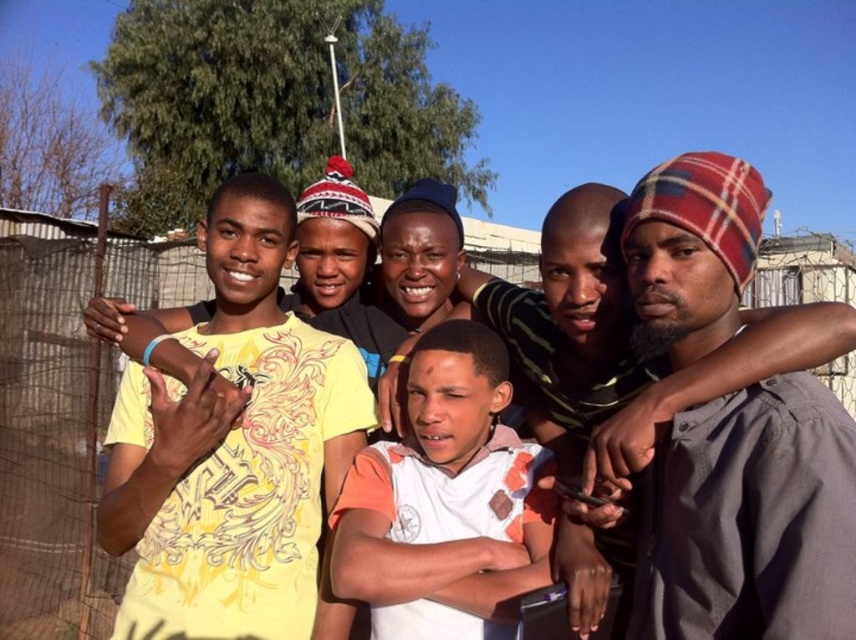
Describe the element at coordinates (64, 412) in the screenshot. The width and height of the screenshot is (856, 640). I see `metallic wire mesh at center` at that location.

This screenshot has height=640, width=856. Identify the location of metallic wire mesh at center. (64, 412).

Does yellow printed t-shirt at center appear under plaid fabric beanie at center?

Yes, yellow printed t-shirt at center is below plaid fabric beanie at center.

Does yellow printed t-shirt at center have a greater height compared to plaid fabric beanie at center?

Yes.

Is point (221, 323) positioned in front of point (837, 493)?

That is False.

Locate an element on the screen. The image size is (856, 640). yellow printed t-shirt at center is located at coordinates (235, 451).

Who is positioned more to the right, plaid fabric beanie at center or white cotton shirt at center?

From the viewer's perspective, plaid fabric beanie at center appears more on the right side.

Is plaid fabric beanie at center shorter than white cotton shirt at center?

No, plaid fabric beanie at center is not shorter than white cotton shirt at center.

Does point (776, 436) come in front of point (363, 545)?

That is True.

Where is `plaid fabric beanie at center`? plaid fabric beanie at center is located at coordinates click(752, 518).